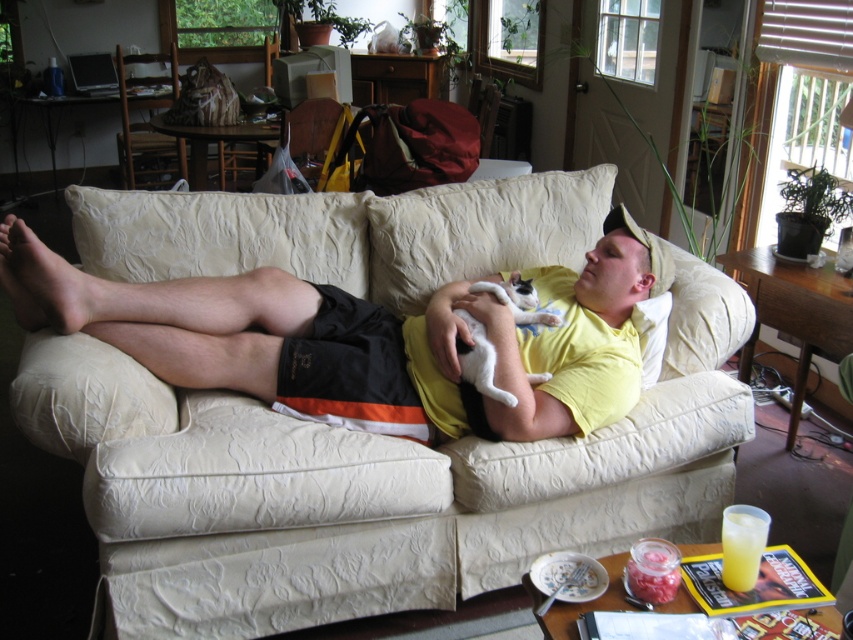
You are a guest in the living room and want to sit down on the beige fabric couch at center without disturbing the white fur cat at center. Which side of the couch should you approach to avoid the cat?

You should approach the right side of the beige fabric couch at center because the white fur cat at center is to the right of the couch, so approaching the left side would be closer to the cat. Wait, according to the Objects Description, the beige fabric couch is to the left of the white fur cat. That means the cat is on the right side of the couch. Therefore, to avoid disturbing the cat, you should approach the left side of the couch where the cat isn there. Hmm, maybe I need to clarify. Let me think again

You are a guest in the living room and want to place a book on the coffee table without moving the yellow translucent cup at lower right. Where should you place the book relative to the beige fabric couch at center?

Place the book to the right of the beige fabric couch at center since the yellow translucent cup at lower right is on the left side of the beige fabric couch at center, so placing it further right would avoid the cup.